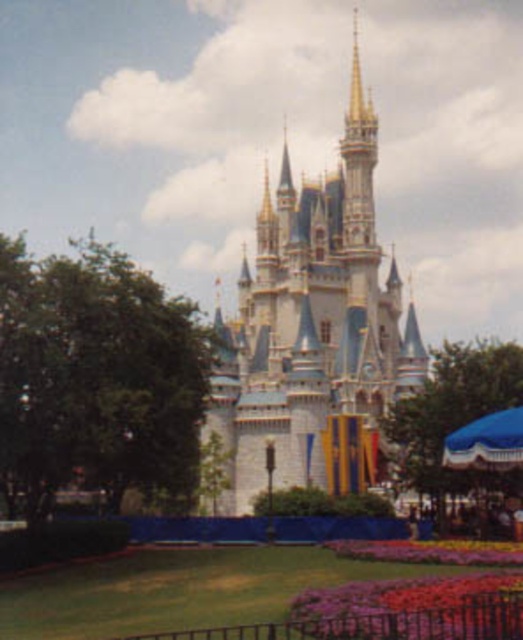
Can you confirm if white glossy castle at center is positioned to the right of purple fabric flower at lower center?

In fact, white glossy castle at center is to the left of purple fabric flower at lower center.

Which is more to the right, white glossy castle at center or purple fabric flower at lower center?

Positioned to the right is purple fabric flower at lower center.

Measure the distance between point (268, 246) and camera.

Point (268, 246) and camera are 136.81 meters apart.

This screenshot has width=523, height=640. I want to click on white glossy castle at center, so click(312, 326).

Is white glossy castle at center above vivid multicolored petals at lower center?

Correct, white glossy castle at center is located above vivid multicolored petals at lower center.

Is white glossy castle at center positioned before vivid multicolored petals at lower center?

No.

I want to click on white glossy castle at center, so click(x=312, y=326).

In order to click on white glossy castle at center in this screenshot , I will do `click(312, 326)`.

Between point (417, 605) and point (483, 560), which one is positioned behind?

The point (483, 560) is behind.

Which is more to the left, vivid multicolored petals at lower center or purple fabric flower at lower center?

From the viewer's perspective, vivid multicolored petals at lower center appears more on the left side.

Who is more forward, (x=303, y=614) or (x=372, y=540)?

Positioned in front is point (x=303, y=614).

Identify the location of vivid multicolored petals at lower center. click(x=414, y=609).